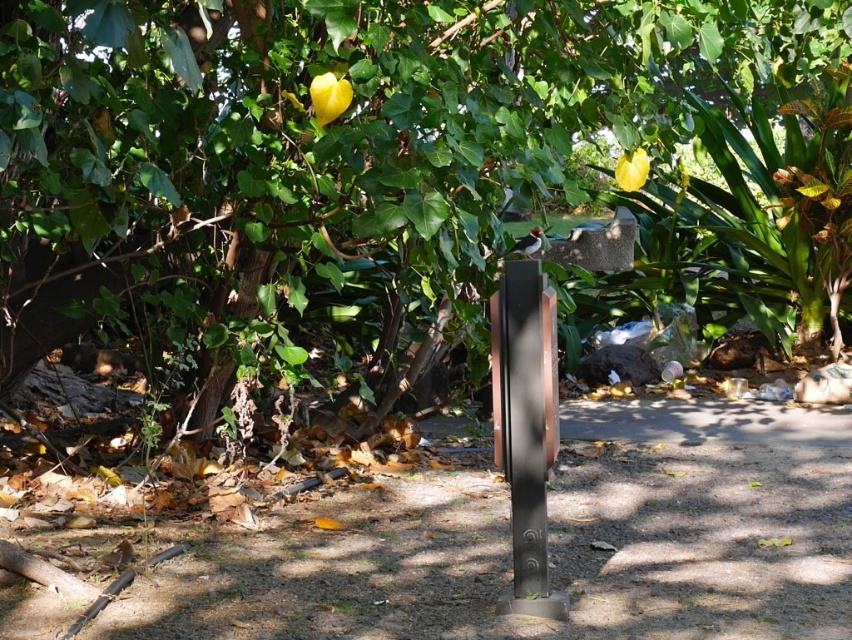
Which of these two, green leafy tree at center or metallic gray post at center, stands shorter?

metallic gray post at center is shorter.

Can you confirm if green leafy tree at center is positioned to the right of metallic gray post at center?

In fact, green leafy tree at center is to the left of metallic gray post at center.

Is point (769, 8) positioned before point (498, 324)?

No.

The height and width of the screenshot is (640, 852). I want to click on green leafy tree at center, so click(x=312, y=131).